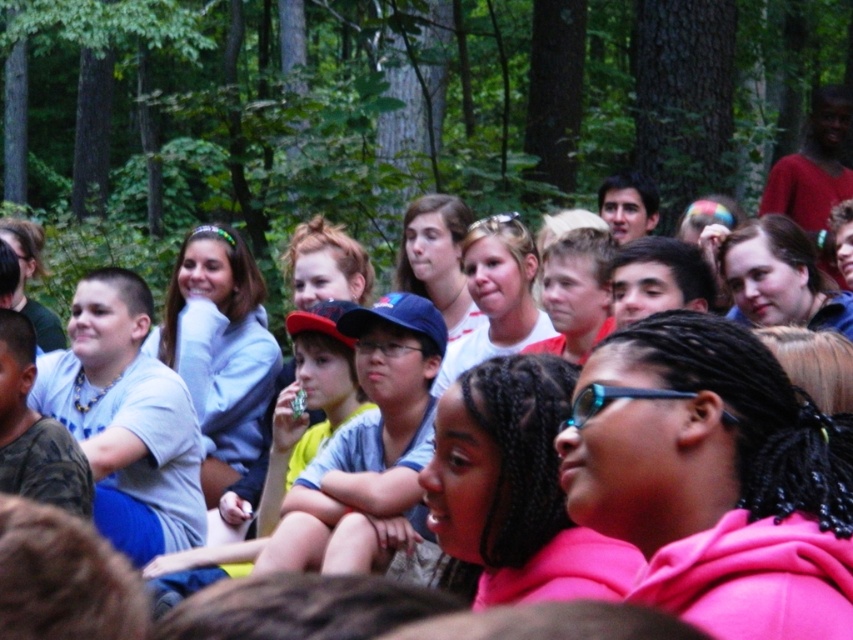
Question: Can you confirm if blue fabric cap at center is positioned to the right of blue plastic goggles at center?

Choices:
 (A) yes
 (B) no

Answer: (B)

Question: Which point is farther from the camera taking this photo?

Choices:
 (A) (364, 541)
 (B) (585, 400)

Answer: (A)

Question: Does blue fabric cap at center appear over blue plastic goggles at center?

Choices:
 (A) yes
 (B) no

Answer: (B)

Question: Does blue fabric cap at center have a lesser width compared to blue plastic goggles at center?

Choices:
 (A) yes
 (B) no

Answer: (B)